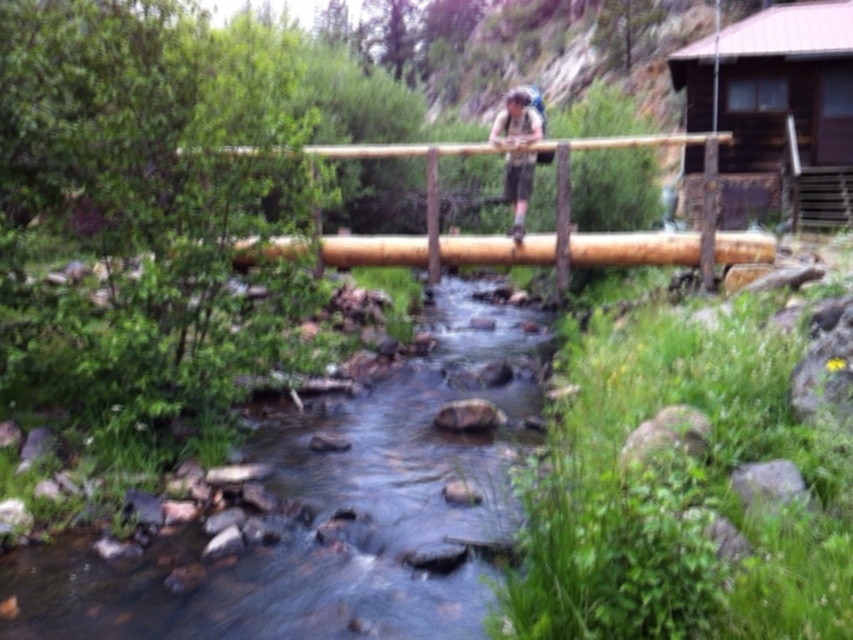
Is clear water at center closer to camera compared to brown wooden pole at upper right?

That is True.

This screenshot has width=853, height=640. What do you see at coordinates (328, 516) in the screenshot?
I see `clear water at center` at bounding box center [328, 516].

Where is `clear water at center`? This screenshot has width=853, height=640. clear water at center is located at coordinates (328, 516).

Does matte gray backpack at center appear under brown wooden pole at upper right?

Correct, matte gray backpack at center is located below brown wooden pole at upper right.

Is point (520, 236) closer to camera compared to point (717, 118)?

That is True.

Locate an element on the screen. The width and height of the screenshot is (853, 640). matte gray backpack at center is located at coordinates (515, 120).

How far apart are brown wooden cabin at upper right and brown wooden rail at center?

brown wooden cabin at upper right and brown wooden rail at center are 11.79 feet apart.

Is point (833, 1) less distant than point (573, 248)?

No.

Who is more forward, (764, 209) or (518, 148)?

Point (518, 148)

Locate an element on the screen. Image resolution: width=853 pixels, height=640 pixels. brown wooden cabin at upper right is located at coordinates (787, 113).